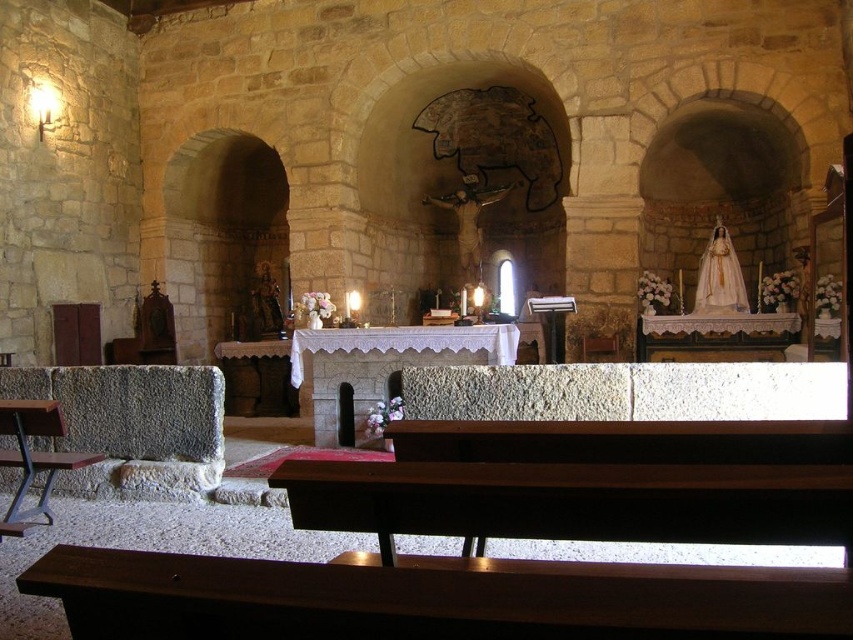
Question: Based on their relative distances, which object is nearer to the white stone altar at center?

Choices:
 (A) wooden polished bench at lower center
 (B) smooth brown wood at lower center

Answer: (A)

Question: In this image, where is wooden polished bench at lower center located relative to white stone altar at center?

Choices:
 (A) above
 (B) below

Answer: (B)

Question: Considering the relative positions of smooth brown wood at lower center and white stone altar at center in the image provided, where is smooth brown wood at lower center located with respect to white stone altar at center?

Choices:
 (A) right
 (B) left

Answer: (A)

Question: Which of the following is the farthest from the observer?

Choices:
 (A) white stone altar at center
 (B) wooden polished bench at lower center
 (C) smooth brown wood at lower center

Answer: (A)

Question: Where is wooden polished bench at lower center located in relation to smooth brown wood at lower center in the image?

Choices:
 (A) above
 (B) below

Answer: (A)

Question: Among these objects, which one is farthest from the camera?

Choices:
 (A) smooth brown wood at lower center
 (B) white stone altar at center
 (C) wooden polished bench at lower center

Answer: (B)